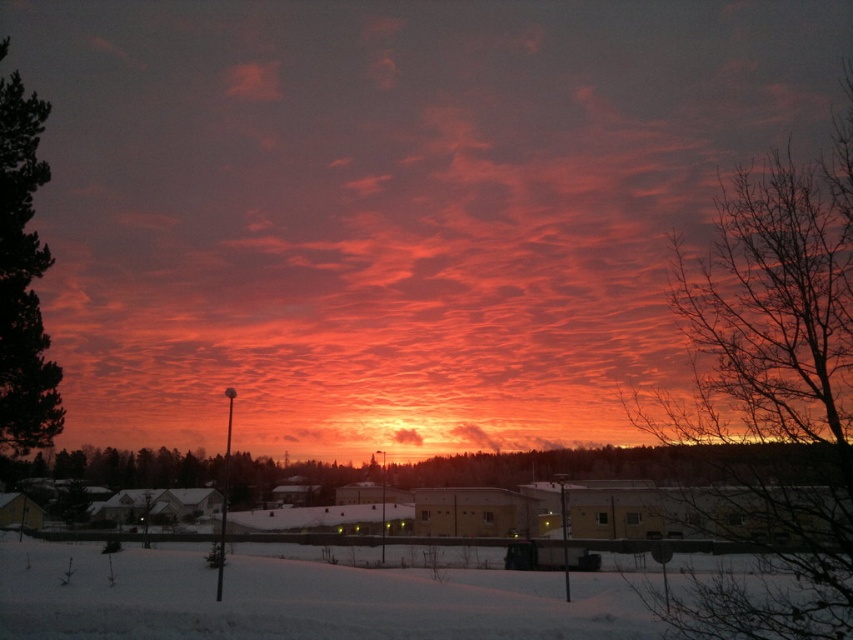
You are an artist painting this winter scene. You want to ensure the proportions between the matte orange cloud at center and the green textured pine tree at left are accurate. Which object should you make wider in your painting?

The matte orange cloud at center should be made wider in the painting since it is wider than the green textured pine tree at left according to the description.

Consider the image. You are an artist planning to paint this winter scene. You want to ensure the bare branches at upper right and the green textured pine tree at left are placed correctly in your painting. Based on their positions in the image, which object should be drawn first to properly layer them?

The bare branches at upper right should be drawn first because it is positioned over the green textured pine tree at left, meaning it should appear on top in the painting.

From the picture: You are an astronomer observing the sky in this winter scene. You notice a point at coordinates (392, 205). What object is located there?

The point at (392, 205) has a matte orange cloud at center.